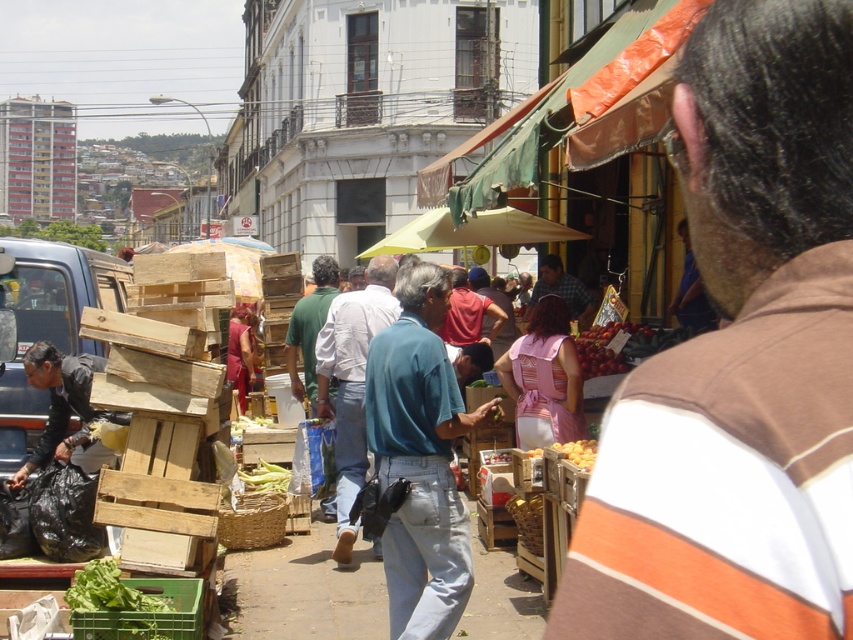
Does shiny red apples at center appear over green matte corn at center?

Correct, shiny red apples at center is located above green matte corn at center.

Is shiny red apples at center taller than green matte corn at center?

Correct, shiny red apples at center is much taller as green matte corn at center.

Is point (627, 349) farther from camera compared to point (268, 461)?

No.

Where is `shiny red apples at center`? shiny red apples at center is located at coordinates (624, 346).

Can you confirm if light blue denim jeans at center is positioned above green leafy lettuce at lower left?

Yes.

Who is lower down, light blue denim jeans at center or green leafy lettuce at lower left?

green leafy lettuce at lower left

At what (x,y) coordinates should I click in order to perform the action: click on light blue denim jeans at center. Please return your answer as a coordinate pair (x, y). Image resolution: width=853 pixels, height=640 pixels. Looking at the image, I should click on (351, 381).

Is shiny red apples at center to the left of green leafy lettuce at lower left from the viewer's perspective?

In fact, shiny red apples at center is to the right of green leafy lettuce at lower left.

The height and width of the screenshot is (640, 853). Identify the location of shiny red apples at center. (624, 346).